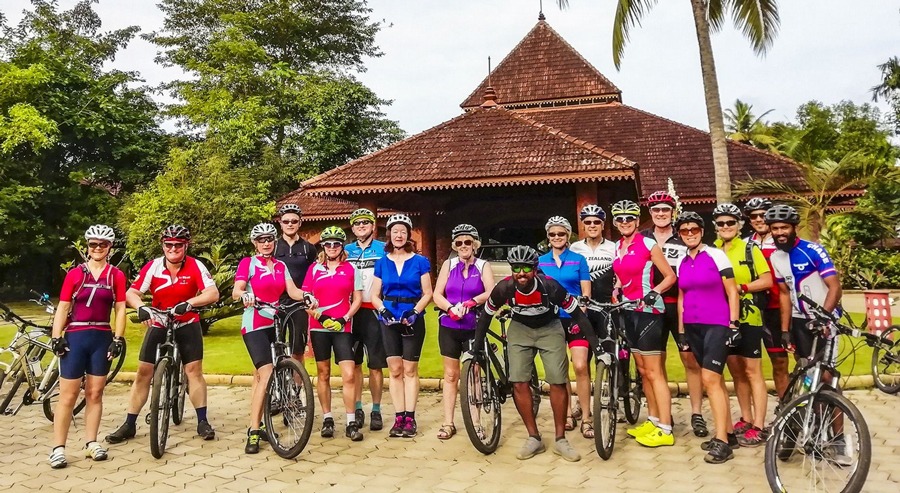
The height and width of the screenshot is (493, 900). I want to click on chair, so click(x=876, y=319).